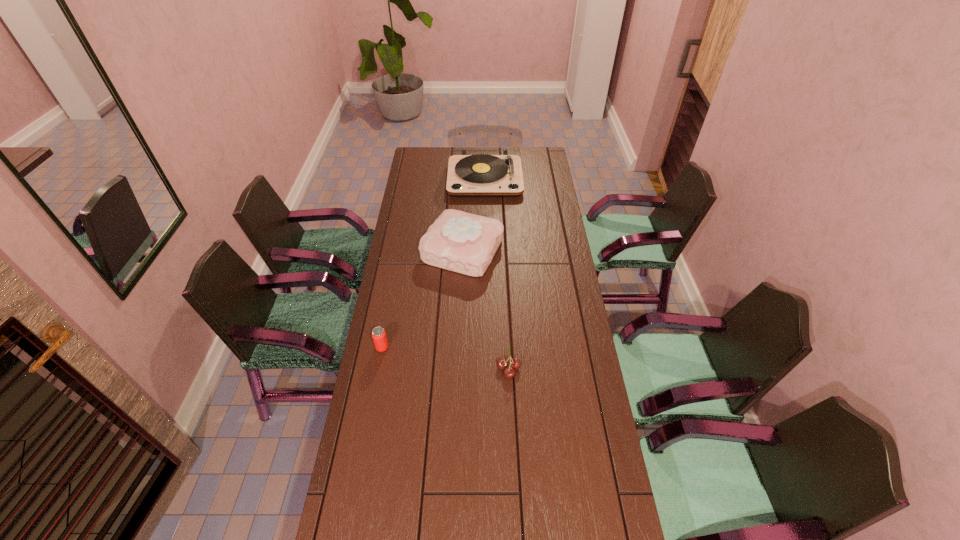
Where is `vacant space at the left edge of the desktop`? vacant space at the left edge of the desktop is located at coordinates (398, 248).

Identify the location of vacant area at the right edge of the desktop. The height and width of the screenshot is (540, 960). (552, 221).

Find the location of a particular element. This screenshot has width=960, height=540. vacant space at the far left corner is located at coordinates (411, 164).

Where is `blank space at the far right corner of the desktop`? Image resolution: width=960 pixels, height=540 pixels. blank space at the far right corner of the desktop is located at coordinates (524, 150).

This screenshot has width=960, height=540. What are the coordinates of `free spot between the nearest object and the beer can` in the screenshot? It's located at (445, 358).

Where is `free point between the beer can and the second tallest object`? The image size is (960, 540). free point between the beer can and the second tallest object is located at coordinates (422, 299).

Where is `free space between the farthest object and the cherry`? The width and height of the screenshot is (960, 540). free space between the farthest object and the cherry is located at coordinates (496, 273).

What are the coordinates of `free space that is in between the third nearest object and the second nearest object` in the screenshot? It's located at (422, 299).

This screenshot has height=540, width=960. I want to click on vacant area that lies between the second tallest object and the second nearest object, so click(x=422, y=299).

Where is `free area in between the third nearest object and the nearest object`? This screenshot has height=540, width=960. free area in between the third nearest object and the nearest object is located at coordinates (486, 309).